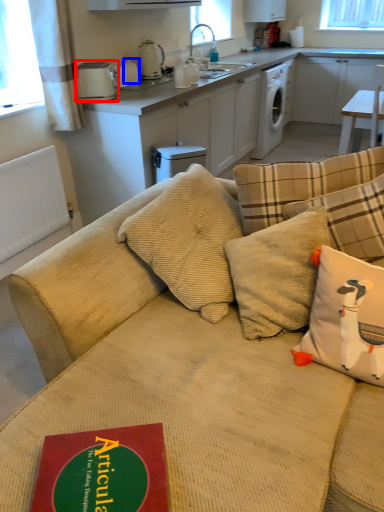
Question: Among these objects, which one is nearest to the camera, appliance (highlighted by a red box) or appliance (highlighted by a blue box)?

Choices:
 (A) appliance
 (B) appliance

Answer: (A)